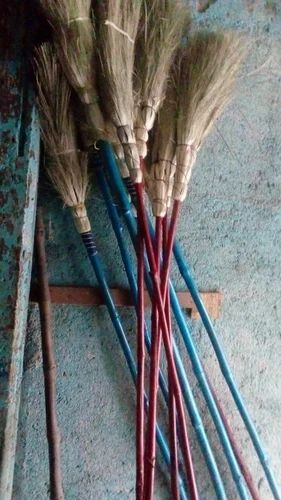
You are a GUI agent. You are given a task and a screenshot of the screen. Output one action in this format:
    pyautogui.click(x=<x>, y=<y>)
    Task: Click on the handle
    This screenshot has width=281, height=500.
    Given the screenshot: What is the action you would take?
    pyautogui.click(x=238, y=455)